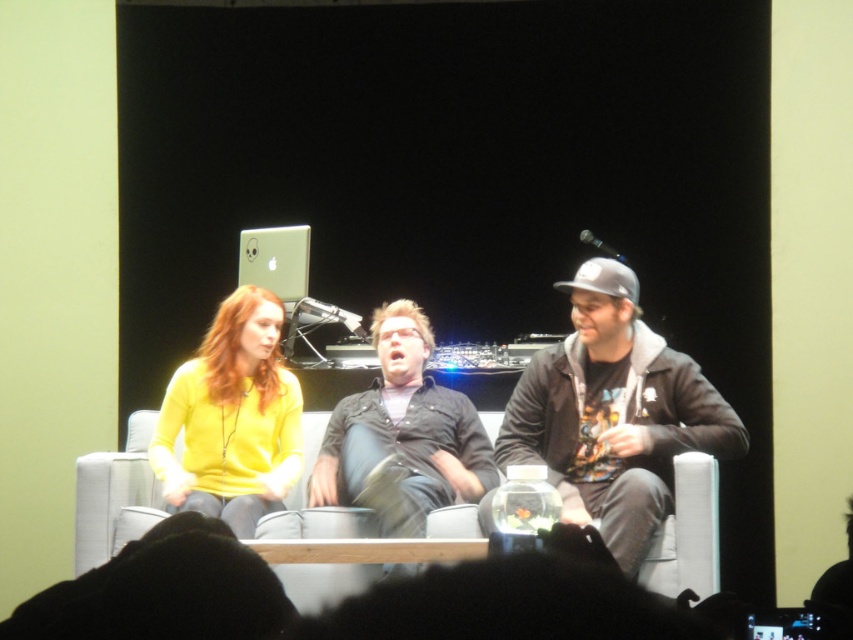
Question: Which of the following is the farthest from the observer?

Choices:
 (A) (86, 560)
 (B) (184, 419)

Answer: (B)

Question: Does dark gray hoodie at center appear on the left side of black matte shirt at center?

Choices:
 (A) yes
 (B) no

Answer: (B)

Question: Which of these objects is positioned farthest from the green matte laptop at upper center?

Choices:
 (A) black matte shirt at center
 (B) gray fabric couch at center
 (C) matte yellow sweater at center

Answer: (B)

Question: Is matte yellow sweater at center positioned before gray fabric couch at center?

Choices:
 (A) yes
 (B) no

Answer: (A)

Question: Does matte yellow sweater at center have a larger size compared to black matte shirt at center?

Choices:
 (A) no
 (B) yes

Answer: (A)

Question: Which object is the farthest from the gray fabric couch at center?

Choices:
 (A) dark gray hoodie at center
 (B) black matte shirt at center

Answer: (A)